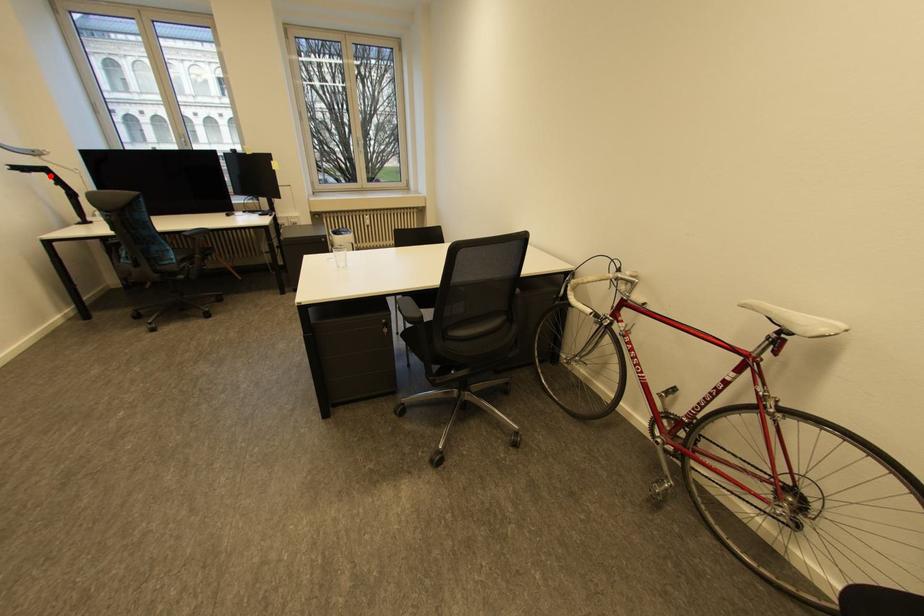
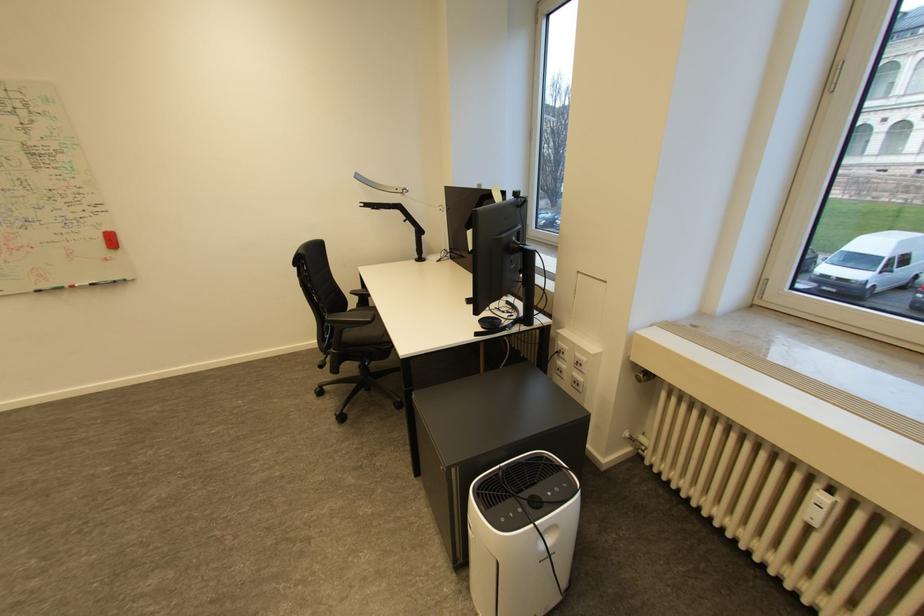
Question: I am providing you with two images of the same scene from different viewpoints. In image1, a red point is highlighted. Considering the same 3D point in image2, which of the following is correct?

Choices:
 (A) It is closer
 (B) It is farther

Answer: (A)